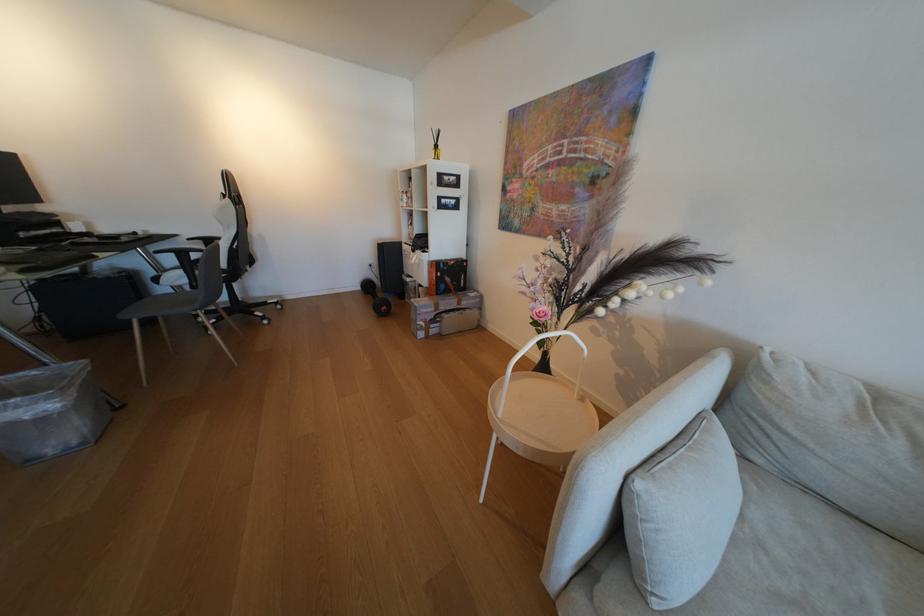
Find where to sit the chair sitting surface. Please return your answer as a coordinate pair (x, y).

(179, 300)